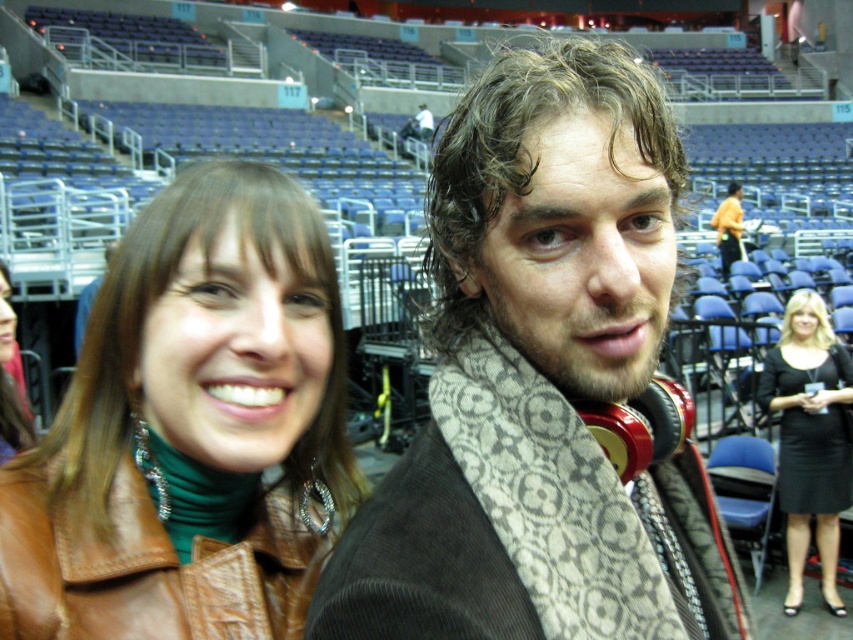
You are standing at the origin of the coordinate system in the image. The patterned scarf at center is located at point (x=541, y=384). If you want to move towards the patterned scarf at center, which direction should you move in terms of the coordinate system?

The point (x=541, y=384) is located to the right and above the origin in the coordinate system, so you should move towards the right and upward direction to reach the patterned scarf at center.

You are standing at the point with coordinates point (598, 500) and want to walk to the point with coordinates point (321, 492). According to the scene, will you have to walk towards the front or the back of the arena?

Since point (321, 492) is behind point (598, 500), you will have to walk towards the back of the arena to reach it.

You are a photographer positioned at the front of the stadium. You want to capture a photo of the beige patterned scarf at center without the brown leather jacket at center blocking it. Is this possible given their current positions?

The beige patterned scarf at center is behind the brown leather jacket at center, so it is currently blocked by the jacket and cannot be seen in the photo without moving either the scarf or the jacket.